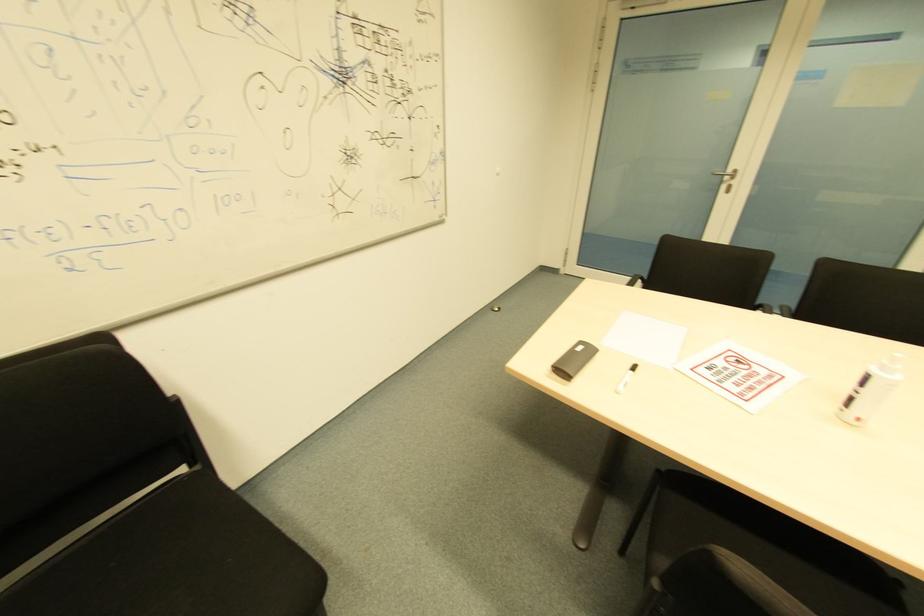
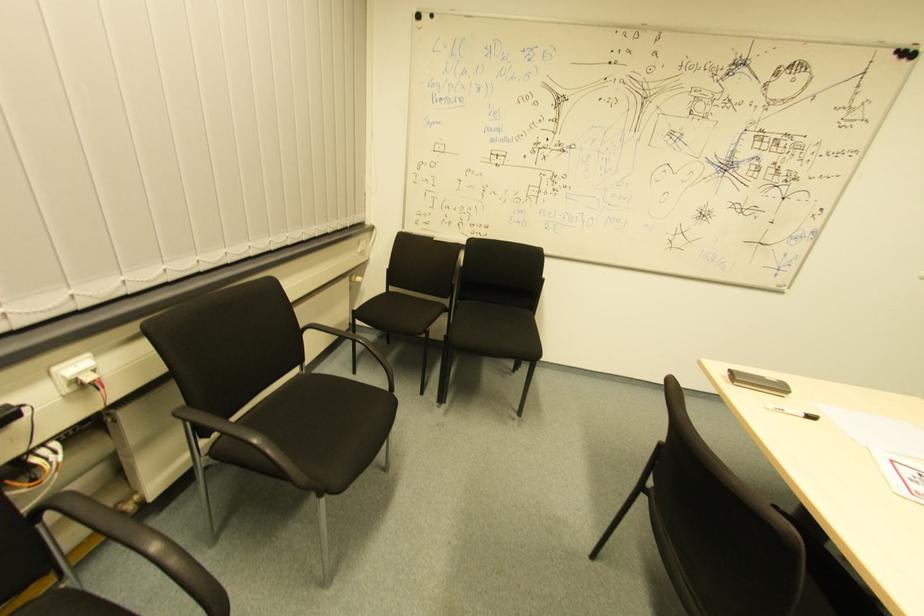
Question: The first image is from the beginning of the video and the second image is from the end. How did the camera likely rotate when shooting the video?

Choices:
 (A) Left
 (B) Right
 (C) Up
 (D) Down

Answer: (A)